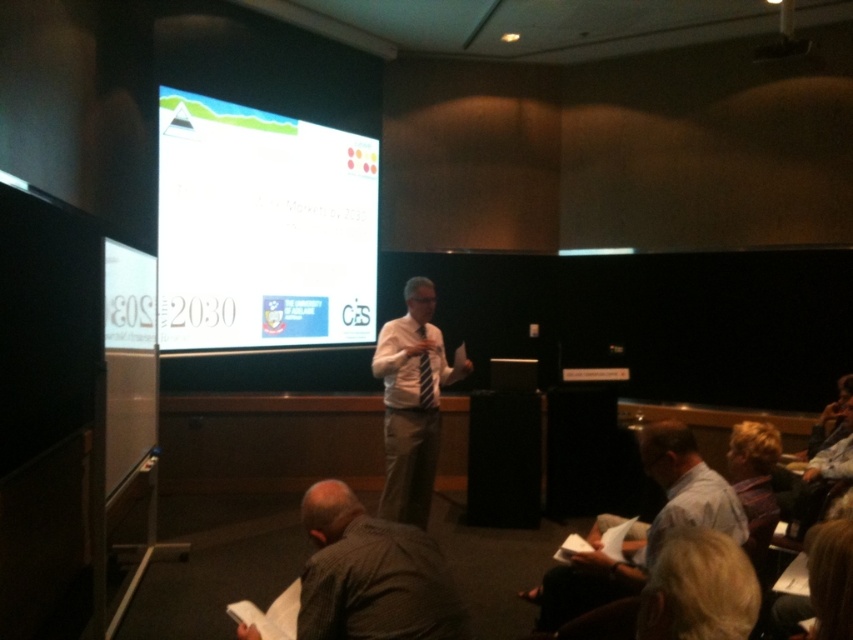
Question: Is light blue shirt at lower right further to the viewer compared to blonde hair at lower right?

Choices:
 (A) no
 (B) yes

Answer: (B)

Question: Which of the following is the closest to the observer?

Choices:
 (A) light blue shirt at lower right
 (B) dark brown shirt at lower center

Answer: (B)

Question: Estimate the real-world distances between objects in this image. Which object is closer to the dark brown shirt at lower center?

Choices:
 (A) white shirt at center
 (B) blonde hair at lower right
 (C) light blue shirt at lower right

Answer: (B)

Question: Is dark brown shirt at lower center to the right of light blue shirt at lower right from the viewer's perspective?

Choices:
 (A) no
 (B) yes

Answer: (A)

Question: Does white glossy projection screen at upper center have a larger size compared to white shirt at center?

Choices:
 (A) no
 (B) yes

Answer: (B)

Question: Which point is farther to the camera?

Choices:
 (A) light blue shirt at lower right
 (B) white glossy projection screen at upper center
 (C) white shirt at center

Answer: (B)